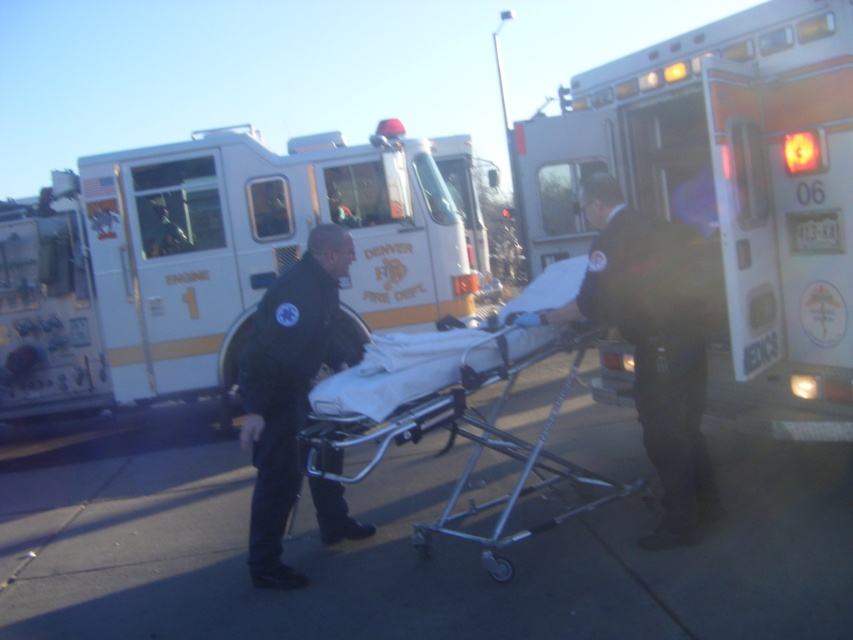
You are a paramedic trying to locate the silver metallic ambulance at right in the scene. Where is it positioned in the image?

The silver metallic ambulance at right is positioned at point 0.305 on the horizontal axis and 0.855 on the vertical axis.

You are a firefighter trying to decide which item to grab first between the white glossy fire truck at center and the black matte uniform at center. Based on their sizes, which one is easier to reach?

The white glossy fire truck at center is bigger than the black matte uniform at center, so it is easier to reach since larger objects are typically easier to grab quickly in an emergency situation.